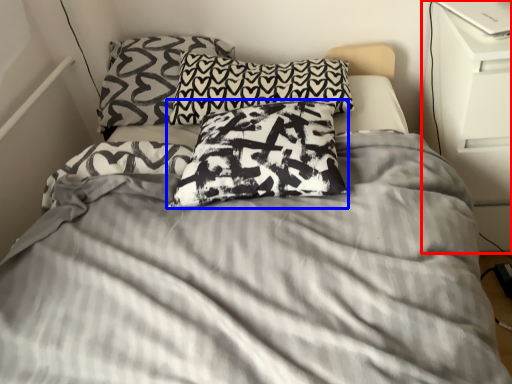
Question: Which object is further to the camera taking this photo, dresser (highlighted by a red box) or pillow (highlighted by a blue box)?

Choices:
 (A) dresser
 (B) pillow

Answer: (A)